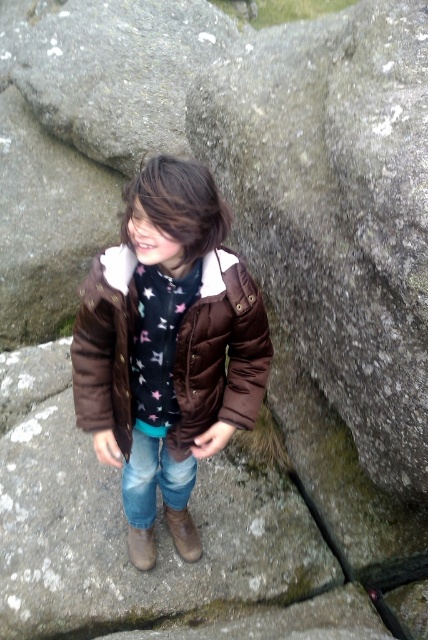
Can you confirm if brown puffy jacket at center is taller than brown suede boot at lower center?

Yes.

Is brown puffy jacket at center to the right of brown suede boot at lower center from the viewer's perspective?

Yes, brown puffy jacket at center is to the right of brown suede boot at lower center.

Who is more forward, (226, 250) or (131, 554)?

Point (226, 250)

Find the location of `brown puffy jacket at center`. brown puffy jacket at center is located at coordinates (219, 353).

Does point (169, 524) lie in front of point (136, 564)?

That is False.

Does brown leather boot at lower center have a greater width compared to brown suede boot at lower center?

Correct, the width of brown leather boot at lower center exceeds that of brown suede boot at lower center.

Measure the distance between point [181,509] and camera.

The distance of point [181,509] from camera is 9.53 feet.

Identify the location of brown leather boot at lower center. (183, 532).

Can you confirm if brown matte jacket at center is shorter than brown suede boot at lower center?

No, brown matte jacket at center is not shorter than brown suede boot at lower center.

Is brown matte jacket at center above brown suede boot at lower center?

Correct, brown matte jacket at center is located above brown suede boot at lower center.

You are a GUI agent. You are given a task and a screenshot of the screen. Output one action in this format:
    pyautogui.click(x=<x>, y=<y>)
    Task: Click on the brown matte jacket at center
    The width and height of the screenshot is (428, 640).
    Given the screenshot: What is the action you would take?
    pyautogui.click(x=178, y=205)

The width and height of the screenshot is (428, 640). What are the coordinates of `brown matte jacket at center` in the screenshot? It's located at (178, 205).